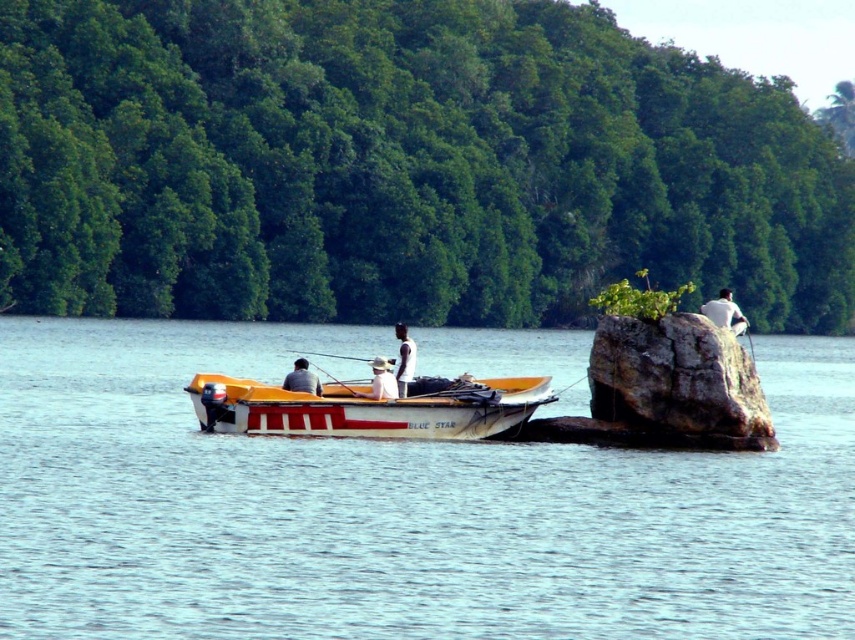
Is point (405, 326) behind point (396, 394)?

Yes, point (405, 326) is farther from viewer.

Does white matte shirt at center appear under white matte hat at center?

No.

Does point (410, 381) come in front of point (373, 368)?

No, (410, 381) is behind (373, 368).

The height and width of the screenshot is (640, 855). In order to click on white matte shirt at center in this screenshot , I will do `click(404, 358)`.

Is point (385, 360) farther from viewer compared to point (299, 378)?

Yes, it is.

Between white matte hat at center and light blue fabric shirt at center, which one appears on the right side from the viewer's perspective?

white matte hat at center

Is point (392, 378) in front of point (310, 376)?

No, it is not.

At what (x,y) coordinates should I click in order to perform the action: click on white matte hat at center. Please return your answer as a coordinate pair (x, y). The width and height of the screenshot is (855, 640). Looking at the image, I should click on (381, 380).

Does blue water at center appear on the right side of white matte hat at center?

Correct, you'll find blue water at center to the right of white matte hat at center.

Between blue water at center and white matte hat at center, which one has more height?

blue water at center is taller.

This screenshot has width=855, height=640. What do you see at coordinates (396, 508) in the screenshot? I see `blue water at center` at bounding box center [396, 508].

Locate an element on the screen. The image size is (855, 640). blue water at center is located at coordinates (396, 508).